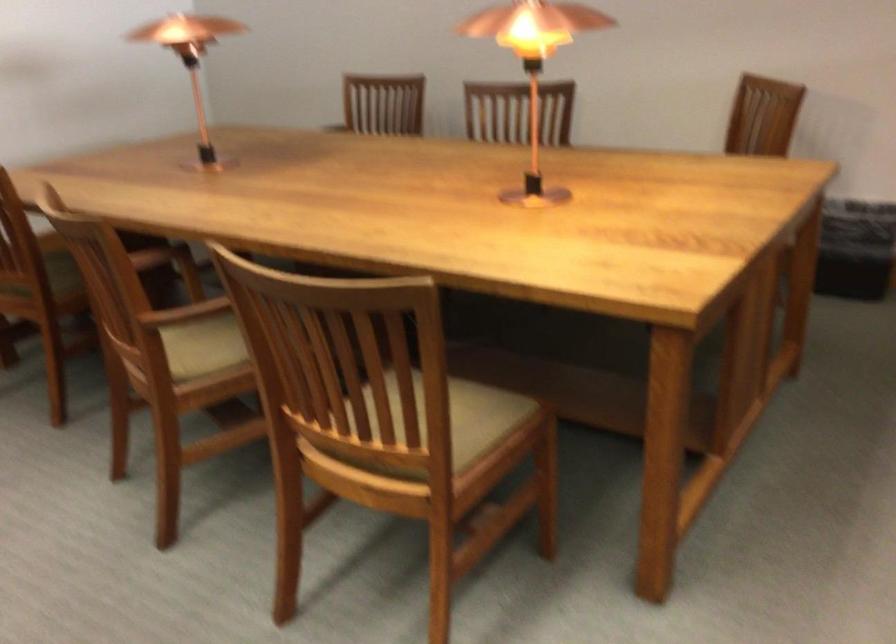
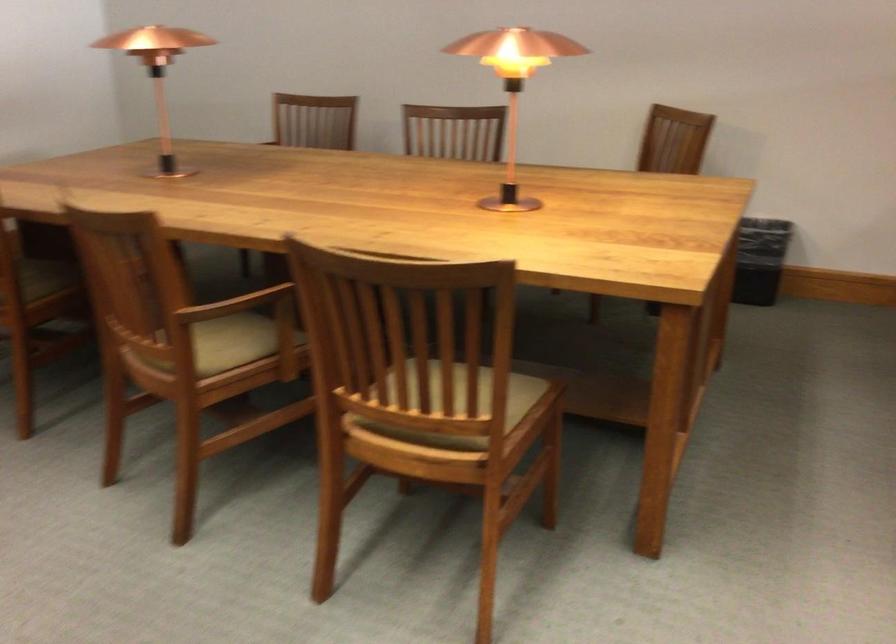
Where in the second image is the point corresponding to the point at 531,67 from the first image?

(513, 88)